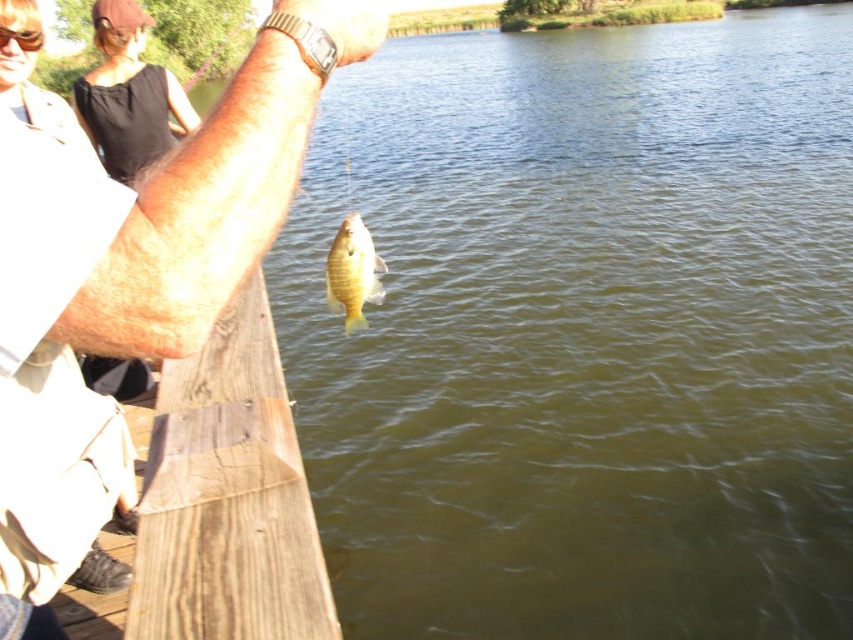
Who is more forward, (312,602) or (25,48)?

Positioned in front is point (312,602).

Between point (213, 579) and point (33, 36), which one is positioned behind?

Positioned behind is point (33, 36).

Which is behind, point (257, 483) or point (4, 26)?

The point (257, 483) is more distant.

Locate an element on the screen. The width and height of the screenshot is (853, 640). brown wood dock at lower left is located at coordinates (218, 502).

Measure the distance from matte wood arm at upper left to transparent plastic goggles at upper left.

matte wood arm at upper left is 6.14 feet away from transparent plastic goggles at upper left.

Looking at this image, who is more distant from viewer, (206, 294) or (32, 45)?

Point (32, 45)

Locate an element on the screen. matte wood arm at upper left is located at coordinates (132, 276).

Consider the image. Does brown wood dock at lower left appear on the right side of yellow shiny fish at center?

Incorrect, brown wood dock at lower left is not on the right side of yellow shiny fish at center.

Does brown wood dock at lower left have a greater height compared to yellow shiny fish at center?

Indeed, brown wood dock at lower left has a greater height compared to yellow shiny fish at center.

Image resolution: width=853 pixels, height=640 pixels. What do you see at coordinates (218, 502) in the screenshot? I see `brown wood dock at lower left` at bounding box center [218, 502].

The image size is (853, 640). I want to click on brown wood dock at lower left, so click(218, 502).